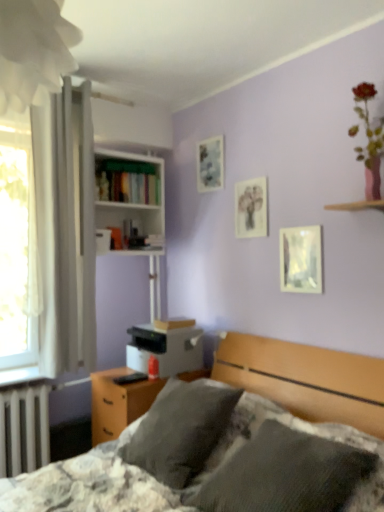
Question: Is matte paper picture frame at center, which is the 2th picture frame in front-to-back order, looking in the opposite direction of white glossy bookcase at upper center?

Choices:
 (A) no
 (B) yes

Answer: (A)

Question: Can you confirm if matte paper picture frame at center, which is counted as the second picture frame, starting from the right, is wider than white glossy bookcase at upper center?

Choices:
 (A) no
 (B) yes

Answer: (A)

Question: Considering the relative sizes of matte paper picture frame at center, the 2th picture frame positioned from the bottom, and white glossy bookcase at upper center in the image provided, is matte paper picture frame at center, the 2th picture frame positioned from the bottom, thinner than white glossy bookcase at upper center?

Choices:
 (A) yes
 (B) no

Answer: (A)

Question: Is matte paper picture frame at center, which is the 2th picture frame in front-to-back order, not within white glossy bookcase at upper center?

Choices:
 (A) yes
 (B) no

Answer: (A)

Question: From the image's perspective, is matte paper picture frame at center, which is counted as the second picture frame, starting from the right, under white glossy bookcase at upper center?

Choices:
 (A) yes
 (B) no

Answer: (A)

Question: Looking at their shapes, would you say matte paper picture frame at center, acting as the second picture frame starting from the top, is wider or thinner than textured gray pillows at center?

Choices:
 (A) wide
 (B) thin

Answer: (B)

Question: Is matte paper picture frame at center, which is the 2th picture frame in front-to-back order, to the left or to the right of textured gray pillows at center in the image?

Choices:
 (A) right
 (B) left

Answer: (A)

Question: From a real-world perspective, is matte paper picture frame at center, which is the 2th picture frame in front-to-back order, above or below textured gray pillows at center?

Choices:
 (A) above
 (B) below

Answer: (A)

Question: From the image's perspective, is matte paper picture frame at center, the 2th picture frame from the back, above or below textured gray pillows at center?

Choices:
 (A) above
 (B) below

Answer: (A)

Question: From the image's perspective, relative to textured gray pillows at center, is metallic reflective picture frame at upper right, the first picture frame positioned from the bottom, above or below?

Choices:
 (A) below
 (B) above

Answer: (B)

Question: Is metallic reflective picture frame at upper right, arranged as the 3th picture frame when viewed from the left, wider or thinner than textured gray pillows at center?

Choices:
 (A) wide
 (B) thin

Answer: (B)

Question: In the image, is metallic reflective picture frame at upper right, the third picture frame when ordered from back to front, positioned in front of or behind textured gray pillows at center?

Choices:
 (A) front
 (B) behind

Answer: (B)

Question: In terms of size, does metallic reflective picture frame at upper right, arranged as the 3th picture frame when viewed from the left, appear bigger or smaller than textured gray pillows at center?

Choices:
 (A) small
 (B) big

Answer: (A)

Question: Is white glossy bookcase at upper center wider or thinner than hardcover books at center-left?

Choices:
 (A) wide
 (B) thin

Answer: (A)

Question: In terms of size, does white glossy bookcase at upper center appear bigger or smaller than hardcover books at center-left?

Choices:
 (A) big
 (B) small

Answer: (A)